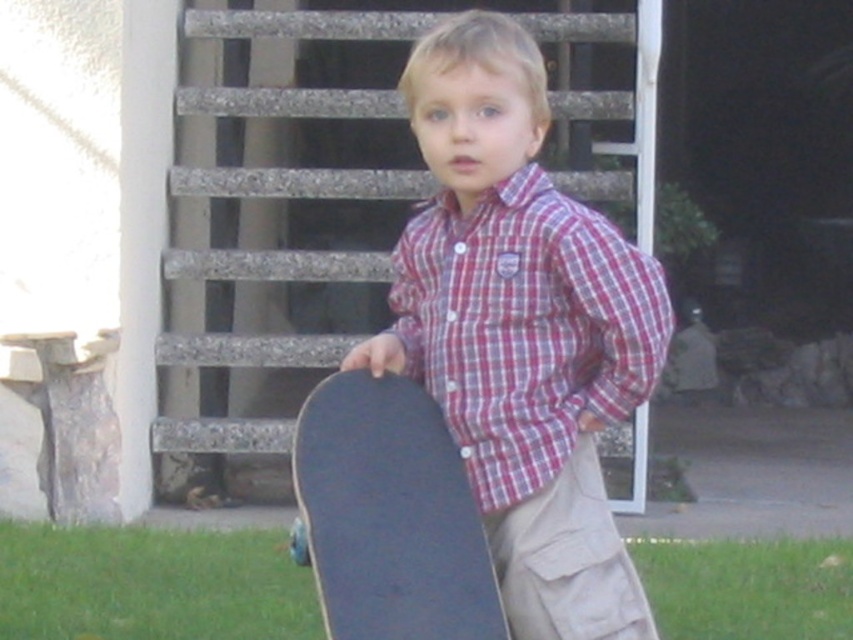
Looking at this image, you are a photographer trying to capture the black matte skateboard at center in the image. The camera you are using has a focus point at coordinate (390, 515). Based on the scene description, will this focus point be effective for capturing the skateboard?

Yes, the focus point at coordinate (390, 515) is effective because it directly marks the location of the black matte skateboard at center.

You are a tailor who needs to determine if the black matte skateboard at center can fit into a storage box designed for the khaki cotton pants at lower center. Based on their sizes, can the skateboard fit?

The black matte skateboard at center is wider than the khaki cotton pants at lower center, so it cannot fit into the storage box designed for the khaki cotton pants at lower center.